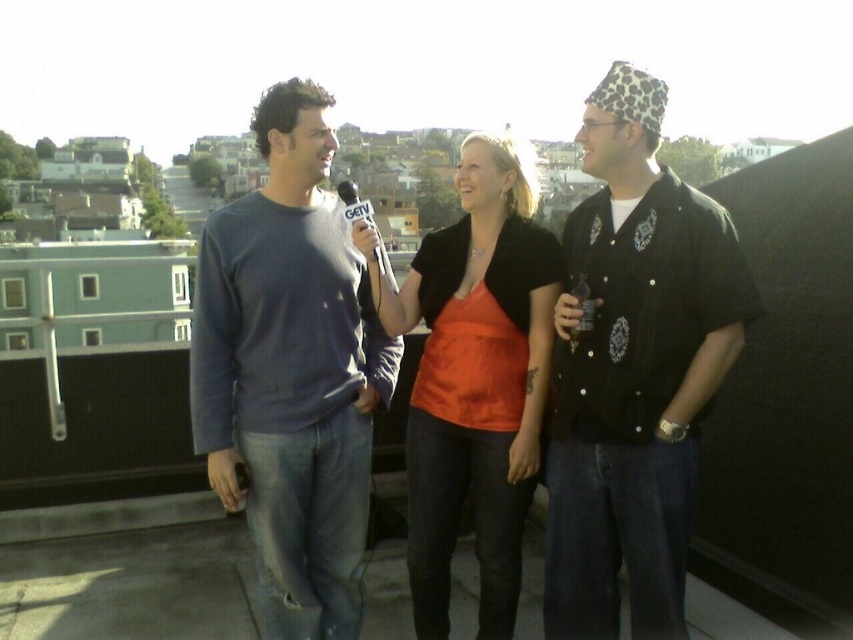
Question: Can you confirm if matte orange shirt at center is positioned below white plastic microphone at center?

Choices:
 (A) no
 (B) yes

Answer: (B)

Question: Can you confirm if leopard print fabric shirt at right is positioned to the right of matte orange shirt at center?

Choices:
 (A) yes
 (B) no

Answer: (A)

Question: Which of the following is the closest to the observer?

Choices:
 (A) (672, 404)
 (B) (527, 173)
 (C) (265, 278)

Answer: (A)

Question: In this image, where is leopard print fabric shirt at right located relative to white plastic microphone at center?

Choices:
 (A) left
 (B) right

Answer: (B)

Question: Which of these objects is positioned closest to the matte orange shirt at center?

Choices:
 (A) dark blue cotton shirt at center
 (B) white plastic microphone at center
 (C) leopard print fabric shirt at right

Answer: (A)

Question: Which point is farther to the camera?

Choices:
 (A) (267, 316)
 (B) (592, 211)
 (C) (431, 545)
 (D) (367, 212)

Answer: (D)